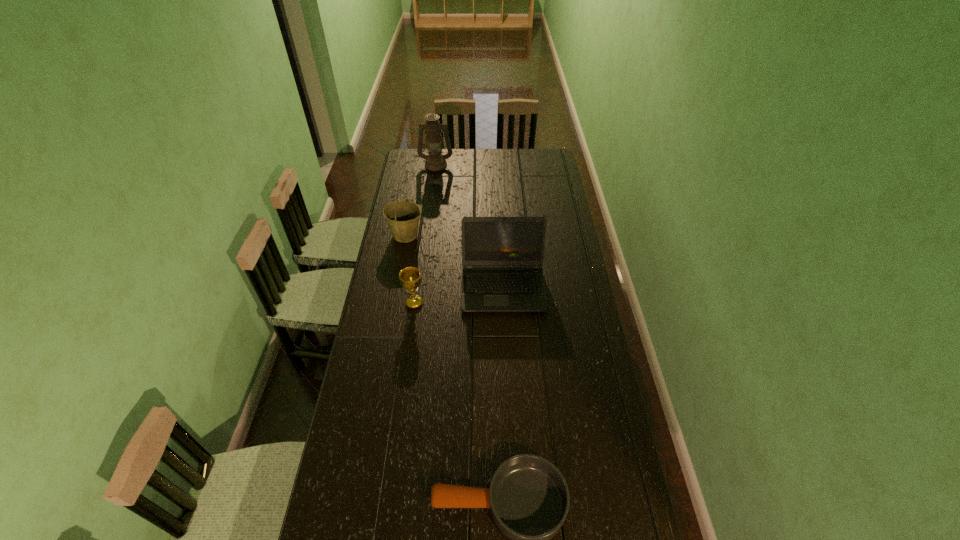
Choose which object is the second nearest neighbor to the pan. Please provide its 2D coordinates. Your answer should be formatted as a tuple, i.e. [(x, y)], where the tuple contains the x and y coordinates of a point satisfying the conditions above.

[(410, 278)]

The width and height of the screenshot is (960, 540). I want to click on object that is the third closest to the laptop_computer, so click(528, 497).